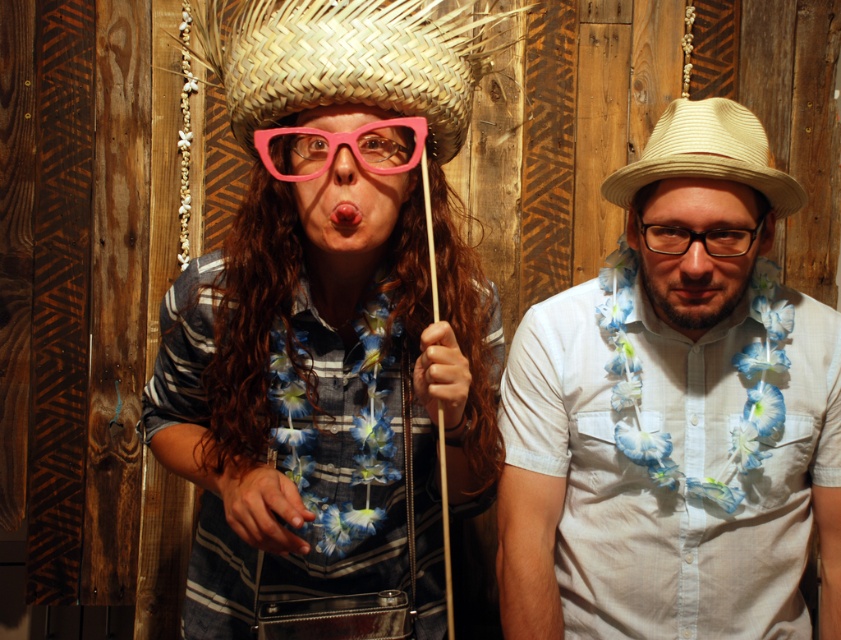
Looking at this image, you are standing in front of the rustic wooden backdrop and want to place a 2.5 feet wide decorative panel between the woven straw cowboy hat at right and yourself. Is there enough space for the panel?

The distance between the woven straw cowboy hat at right and the viewer is 3.73 feet. Since the decorative panel is 2.5 feet wide, there is enough space to place it between them as 2.5 feet is less than 3.73 feet.

You are a photographer trying to capture a closeup shot of the person on the left. You notice the matte pink glasses at center and the pink matte lips at center. Which object should you focus on first if you want to ensure both are in focus, considering their sizes?

The matte pink glasses at center has a larger width than the pink matte lips at center, so focusing on the matte pink glasses at center first would help ensure both are in focus since it is bigger and might require more precise adjustment.